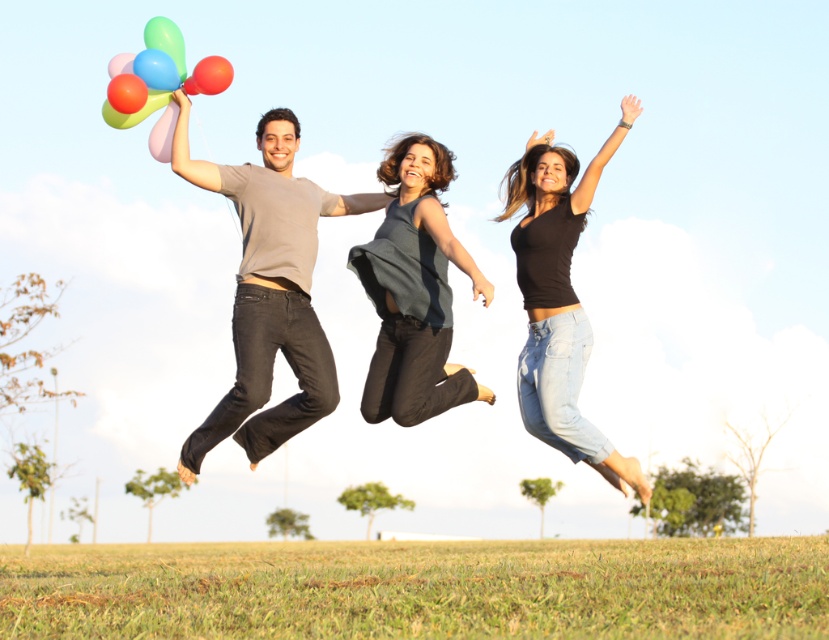
Question: Can you confirm if matte gray t-shirt at left is wider than matte gray t-shirt at center?

Choices:
 (A) no
 (B) yes

Answer: (B)

Question: Estimate the real-world distances between objects in this image. Which object is farther from the matte gray t-shirt at center?

Choices:
 (A) rubberized glossy balloon at upper center
 (B) green grassy field at lower center

Answer: (B)

Question: Does green grassy field at lower center appear on the left side of matte gray t-shirt at center?

Choices:
 (A) yes
 (B) no

Answer: (A)

Question: Is green grassy field at lower center smaller than dark gray sleeveless top at center?

Choices:
 (A) no
 (B) yes

Answer: (A)

Question: Which object is the farthest from the matte gray t-shirt at left?

Choices:
 (A) matte gray t-shirt at center
 (B) green grassy field at lower center
 (C) dark gray sleeveless top at center
 (D) rubberized glossy balloon at upper center

Answer: (B)

Question: Based on their relative distances, which object is farther from the dark gray sleeveless top at center?

Choices:
 (A) green grassy field at lower center
 (B) matte gray t-shirt at center
 (C) rubberized glossy balloon at upper center
 (D) matte gray t-shirt at left

Answer: (A)